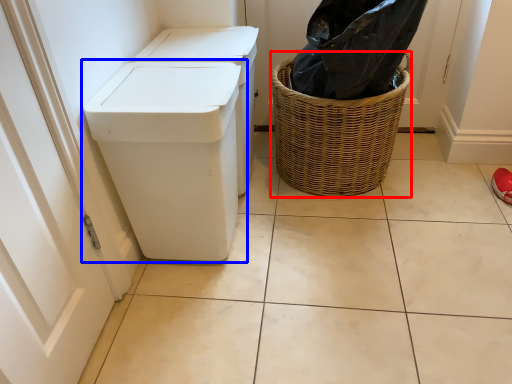
Question: Which point is closer to the camera, basket (highlighted by a red box) or waste container (highlighted by a blue box)?

Choices:
 (A) basket
 (B) waste container

Answer: (B)